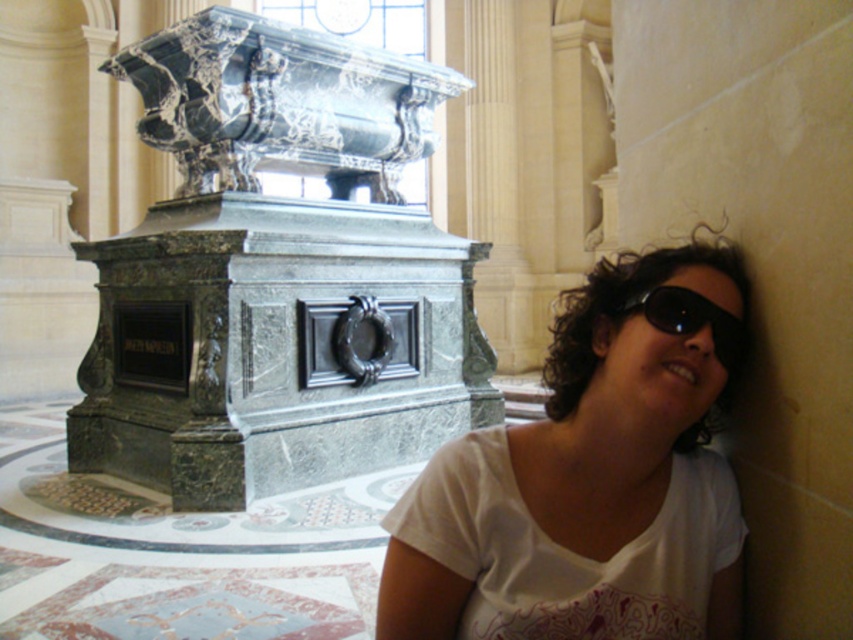
Question: Which of the following is the closest to the observer?

Choices:
 (A) (683, 307)
 (B) (729, 524)

Answer: (A)

Question: In this image, where is white cotton shirt at lower right located relative to black plastic goggles at lower right?

Choices:
 (A) right
 (B) left

Answer: (B)

Question: Among these objects, which one is nearest to the camera?

Choices:
 (A) white cotton shirt at lower right
 (B) black plastic goggles at lower right

Answer: (A)

Question: Can you confirm if white cotton shirt at lower right is bigger than black plastic goggles at lower right?

Choices:
 (A) yes
 (B) no

Answer: (A)

Question: Does white cotton shirt at lower right have a larger size compared to black plastic goggles at lower right?

Choices:
 (A) no
 (B) yes

Answer: (B)